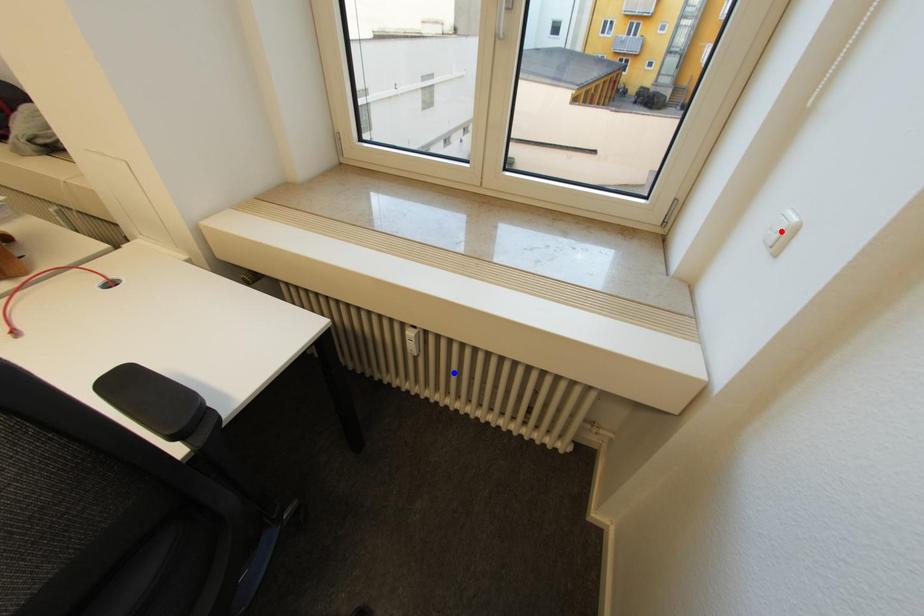
Question: Two points are marked on the image. Which point is closer to the camera?

Choices:
 (A) Blue point is closer.
 (B) Red point is closer.

Answer: (B)